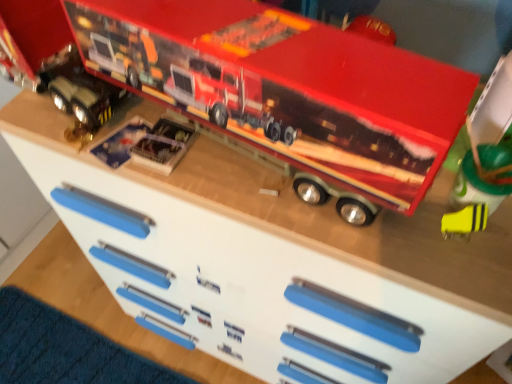
Find the location of `blank space situated above metallic red truck at upper center, which ranks as the 2th toy in right-to-left order (from a real-world perspective)`. blank space situated above metallic red truck at upper center, which ranks as the 2th toy in right-to-left order (from a real-world perspective) is located at coordinates (255, 41).